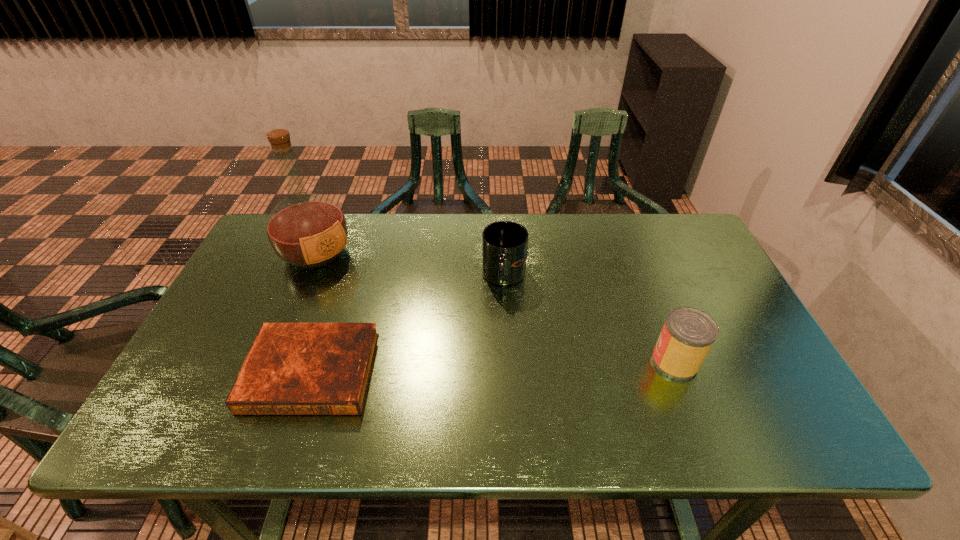
Locate an element on the screen. vacant spot on the desktop that is between the Bible and the rightmost object and is positioned with the handle on the side of the third object from left to right is located at coordinates (454, 368).

This screenshot has height=540, width=960. Identify the location of free spot on the desktop that is between the Bible and the rightmost object and is positioned on the front label of the tallest object. (445, 368).